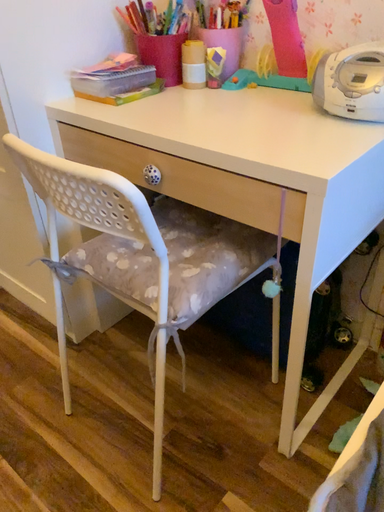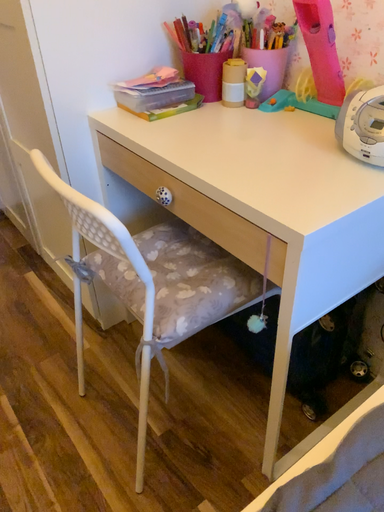
Question: How did the camera likely rotate when shooting the video?

Choices:
 (A) rotated left
 (B) rotated right

Answer: (A)